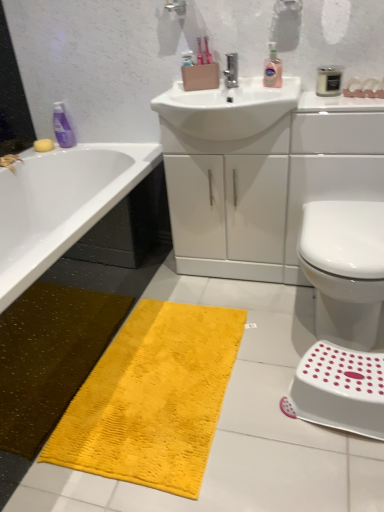
I want to click on blank space situated above yellow plush bath mat at lower center (from a real-world perspective), so click(x=168, y=368).